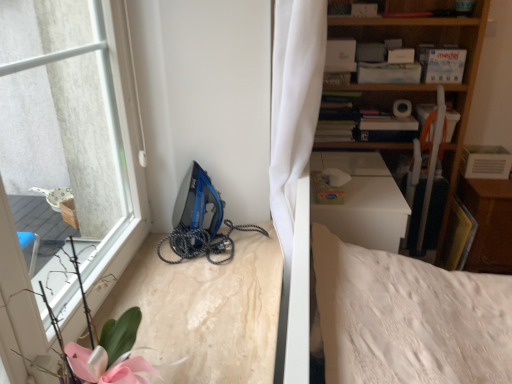
Question: Is blue plastic iron at lower left at the left side of wooden bookshelf at upper right?

Choices:
 (A) yes
 (B) no

Answer: (A)

Question: Are blue plastic iron at lower left and wooden bookshelf at upper right far apart?

Choices:
 (A) yes
 (B) no

Answer: (A)

Question: From a real-world perspective, is blue plastic iron at lower left below wooden bookshelf at upper right?

Choices:
 (A) no
 (B) yes

Answer: (A)

Question: Does blue plastic iron at lower left appear on the right side of wooden bookshelf at upper right?

Choices:
 (A) no
 (B) yes

Answer: (A)

Question: Can you confirm if blue plastic iron at lower left is taller than wooden bookshelf at upper right?

Choices:
 (A) yes
 (B) no

Answer: (B)

Question: Is the surface of blue plastic iron at lower left in direct contact with wooden bookshelf at upper right?

Choices:
 (A) yes
 (B) no

Answer: (B)

Question: Does blue plastic iron at lower left have a lesser width compared to wooden dresser at right?

Choices:
 (A) no
 (B) yes

Answer: (B)

Question: Could wooden dresser at right be considered to be inside blue plastic iron at lower left?

Choices:
 (A) no
 (B) yes

Answer: (A)

Question: From the image's perspective, is blue plastic iron at lower left located above wooden dresser at right?

Choices:
 (A) no
 (B) yes

Answer: (B)

Question: Does blue plastic iron at lower left have a greater height compared to wooden dresser at right?

Choices:
 (A) yes
 (B) no

Answer: (B)

Question: From a real-world perspective, is blue plastic iron at lower left physically below wooden dresser at right?

Choices:
 (A) no
 (B) yes

Answer: (A)

Question: Are blue plastic iron at lower left and wooden dresser at right located far from each other?

Choices:
 (A) no
 (B) yes

Answer: (B)

Question: From a real-world perspective, is wooden bookshelf at upper right positioned over wooden dresser at right based on gravity?

Choices:
 (A) yes
 (B) no

Answer: (A)